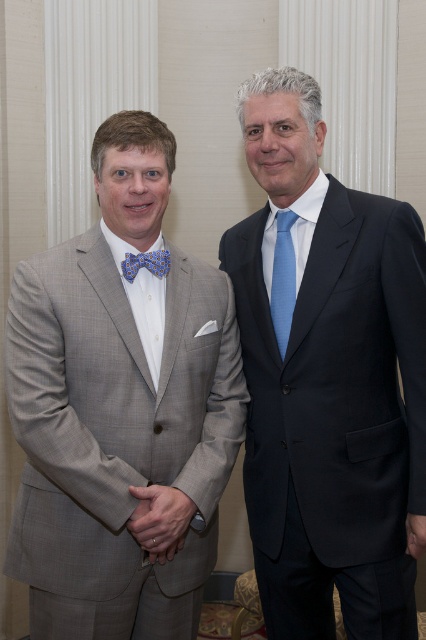
Question: Which object is positioned farthest from the satin black suit at right?

Choices:
 (A) light blue textured tie at center
 (B) light gray textured suit at left
 (C) blue printed fabric bow tie at left

Answer: (C)

Question: Is satin black suit at right wider than blue printed fabric bow tie at left?

Choices:
 (A) no
 (B) yes

Answer: (B)

Question: Among these points, which one is farthest from the camera?

Choices:
 (A) (154, 253)
 (B) (360, 577)
 (C) (291, 276)
 (D) (57, 262)

Answer: (C)

Question: Which point is farther from the camera taking this photo?

Choices:
 (A) (181, 499)
 (B) (397, 276)

Answer: (B)

Question: Can you confirm if light gray textured suit at left is positioned below light blue textured tie at center?

Choices:
 (A) no
 (B) yes

Answer: (B)

Question: Is light gray textured suit at left wider than satin black suit at right?

Choices:
 (A) no
 (B) yes

Answer: (B)